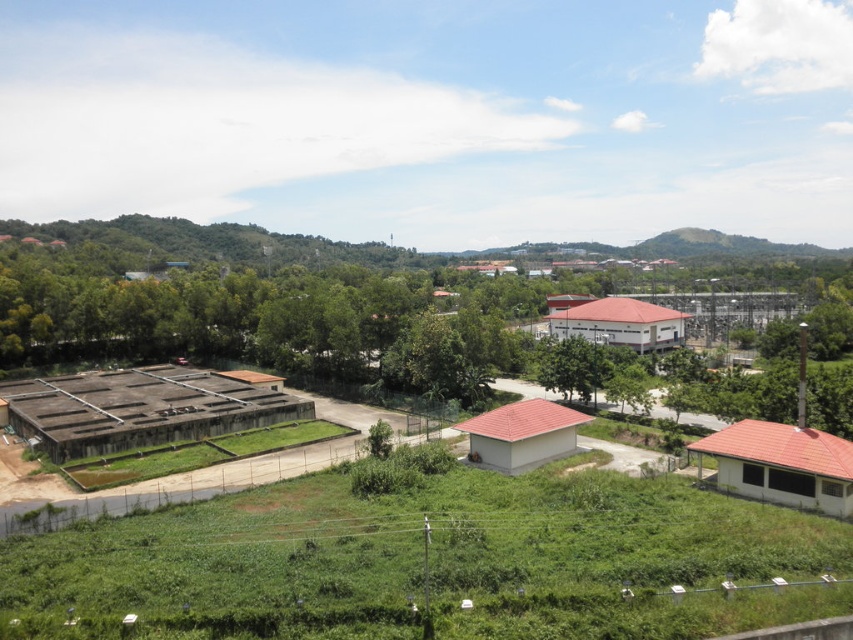
Question: Which point is closer to the camera taking this photo?

Choices:
 (A) (355, 323)
 (B) (769, 243)

Answer: (A)

Question: Can you confirm if green leafy tree at center is bigger than green grassy hillside at center?

Choices:
 (A) yes
 (B) no

Answer: (A)

Question: Which of the following is the farthest from the observer?

Choices:
 (A) green grassy hillside at center
 (B) green leafy tree at center

Answer: (A)

Question: Where is green leafy tree at center located in relation to green grassy hillside at center in the image?

Choices:
 (A) below
 (B) above

Answer: (A)

Question: Which of the following is the closest to the observer?

Choices:
 (A) green grassy hillside at center
 (B) green leafy tree at center

Answer: (B)

Question: Does green leafy tree at center have a smaller size compared to green grassy hillside at center?

Choices:
 (A) no
 (B) yes

Answer: (A)